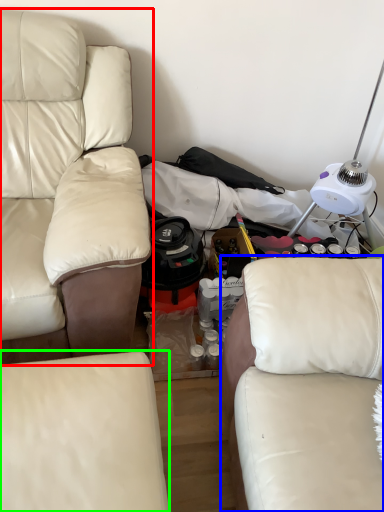
Question: Estimate the real-world distances between objects in this image. Which object is closer to studio couch (highlighted by a red box), studio couch (highlighted by a blue box) or studio couch (highlighted by a green box)?

Choices:
 (A) studio couch
 (B) studio couch

Answer: (B)